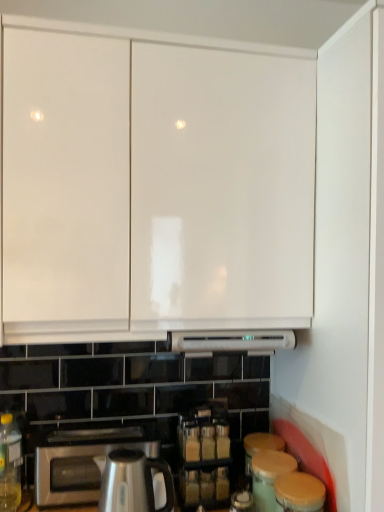
Question: Looking at the image, does translucent yellow bottle at lower left seem bigger or smaller compared to white glossy cabinet at upper center?

Choices:
 (A) big
 (B) small

Answer: (B)

Question: Relative to white glossy cabinet at upper center, is translucent yellow bottle at lower left in front or behind?

Choices:
 (A) front
 (B) behind

Answer: (B)

Question: Considering the real-world distances, which object is closest to the white glossy cabinet at upper center?

Choices:
 (A) translucent yellow bottle at lower left
 (B) satin silver toaster at lower left
 (C) satin silver kettle at lower center

Answer: (C)

Question: Which object is the closest to the white glossy cabinet at upper center?

Choices:
 (A) satin silver kettle at lower center
 (B) translucent yellow bottle at lower left
 (C) satin silver toaster at lower left

Answer: (A)